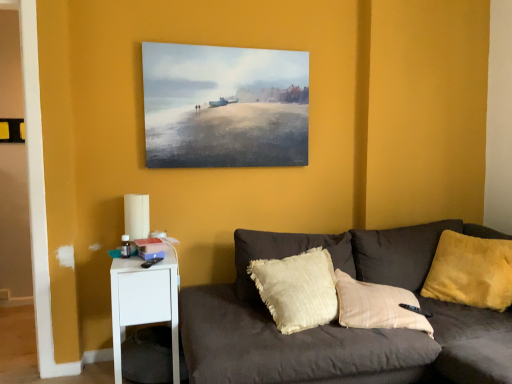
Question: Is white plastic nightstand at lower left at the right side of white paper lampshade at left?

Choices:
 (A) yes
 (B) no

Answer: (A)

Question: Considering the relative positions of white plastic nightstand at lower left and white paper lampshade at left in the image provided, is white plastic nightstand at lower left in front of white paper lampshade at left?

Choices:
 (A) no
 (B) yes

Answer: (B)

Question: Does white plastic nightstand at lower left appear on the left side of white paper lampshade at left?

Choices:
 (A) yes
 (B) no

Answer: (B)

Question: Is the depth of white plastic nightstand at lower left greater than that of white paper lampshade at left?

Choices:
 (A) no
 (B) yes

Answer: (A)

Question: From the image's perspective, is white plastic nightstand at lower left over white paper lampshade at left?

Choices:
 (A) no
 (B) yes

Answer: (A)

Question: Is dark gray fabric couch at lower right spatially inside white plastic nightstand at lower left, or outside of it?

Choices:
 (A) inside
 (B) outside

Answer: (B)

Question: Is point (509, 375) closer or farther from the camera than point (139, 264)?

Choices:
 (A) farther
 (B) closer

Answer: (B)

Question: Is dark gray fabric couch at lower right taller or shorter than white plastic nightstand at lower left?

Choices:
 (A) tall
 (B) short

Answer: (B)

Question: Looking at their shapes, would you say dark gray fabric couch at lower right is wider or thinner than white plastic nightstand at lower left?

Choices:
 (A) wide
 (B) thin

Answer: (A)

Question: From a real-world perspective, is white paper lampshade at left physically located above or below dark gray fabric couch at lower right?

Choices:
 (A) below
 (B) above

Answer: (B)

Question: Do you think white paper lampshade at left is within dark gray fabric couch at lower right, or outside of it?

Choices:
 (A) inside
 (B) outside

Answer: (B)

Question: Is white paper lampshade at left taller or shorter than dark gray fabric couch at lower right?

Choices:
 (A) short
 (B) tall

Answer: (A)

Question: Looking at their shapes, would you say white paper lampshade at left is wider or thinner than dark gray fabric couch at lower right?

Choices:
 (A) thin
 (B) wide

Answer: (A)

Question: Is yellow plush pillow at right in front of or behind dark gray fabric couch at lower right in the image?

Choices:
 (A) behind
 (B) front

Answer: (A)

Question: From the image's perspective, is yellow plush pillow at right above or below dark gray fabric couch at lower right?

Choices:
 (A) below
 (B) above

Answer: (B)